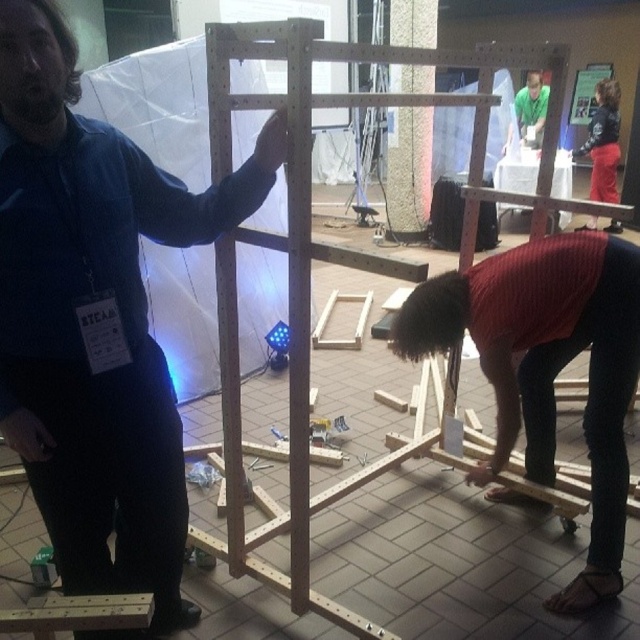
Is natural wood easel at center wider than knit red sweater at lower center?

Yes, natural wood easel at center is wider than knit red sweater at lower center.

What do you see at coordinates (320, 257) in the screenshot? The width and height of the screenshot is (640, 640). I see `natural wood easel at center` at bounding box center [320, 257].

The height and width of the screenshot is (640, 640). I want to click on natural wood easel at center, so click(x=320, y=257).

Locate an element on the screen. Image resolution: width=640 pixels, height=640 pixels. knit red sweater at lower center is located at coordinates (547, 368).

Can you confirm if knit red sweater at lower center is taller than red fabric skirt at lower right?

Incorrect, knit red sweater at lower center's height is not larger of red fabric skirt at lower right's.

The image size is (640, 640). What are the coordinates of `knit red sweater at lower center` in the screenshot? It's located at tap(547, 368).

Locate an element on the screen. The width and height of the screenshot is (640, 640). knit red sweater at lower center is located at coordinates pyautogui.click(x=547, y=368).

Can you confirm if blue fabric shirt at upper left is shorter than natural wood easel at center?

Indeed, blue fabric shirt at upper left has a lesser height compared to natural wood easel at center.

Between blue fabric shirt at upper left and natural wood easel at center, which one has less height?

Standing shorter between the two is blue fabric shirt at upper left.

Which is in front, point (22, 8) or point (330, 612)?

Positioned in front is point (22, 8).

This screenshot has width=640, height=640. What are the coordinates of `blue fabric shirt at upper left` in the screenshot? It's located at (97, 320).